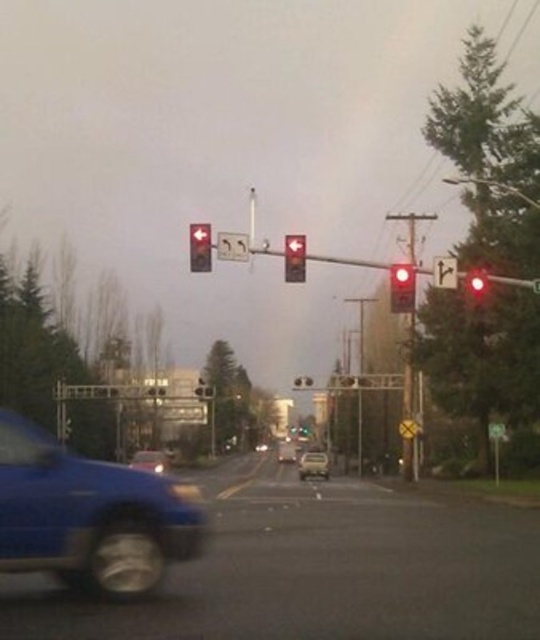
You are standing at the intersection and want to take a photo of both point (x=135, y=488) and point (x=130, y=464) in the scene. Which point should you focus on first to ensure both are in clear view?

Point (x=135, y=488) is closer to the camera than point (x=130, y=464). To ensure both are in clear view, focus on the closer point first, which is point (x=135, y=488).

You are a pedestrian waiting at the crosswalk near the traffic signals. You notice a metallic silver sedan at center and a matte silver suv at center. Which vehicle is positioned closer to the right side of the road?

The metallic silver sedan at center is positioned to the right of the matte silver suv at center, so it is closer to the right side of the road.